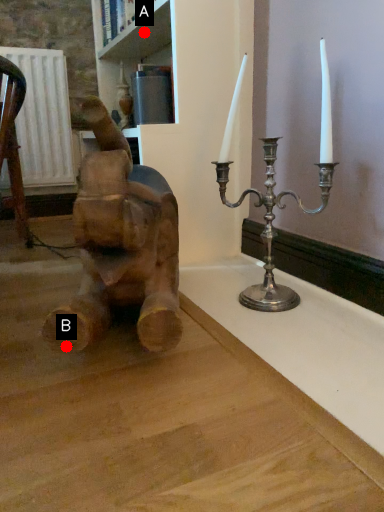
Question: Two points are circled on the image, labeled by A and B beside each circle. Which point is farther to the camera?

Choices:
 (A) A is further
 (B) B is further

Answer: (A)